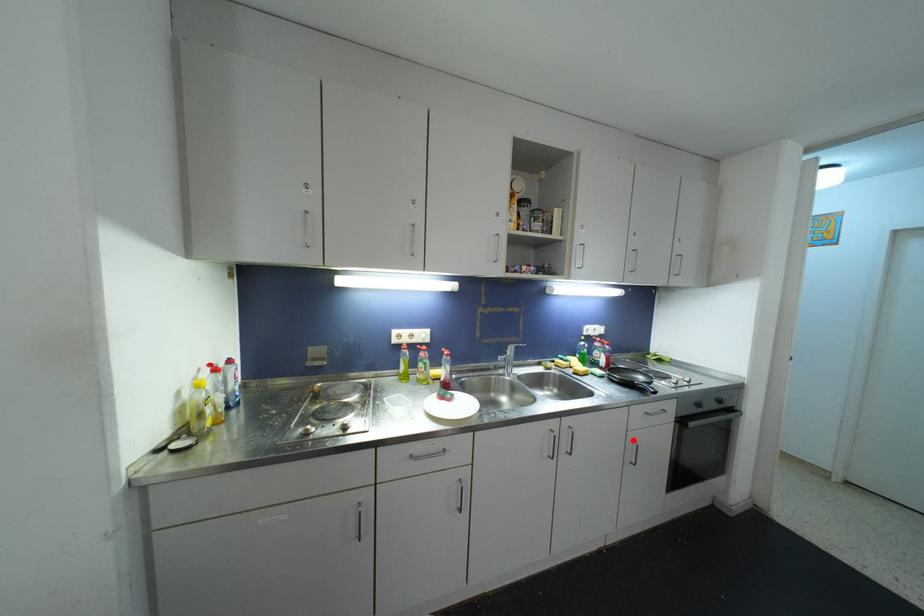
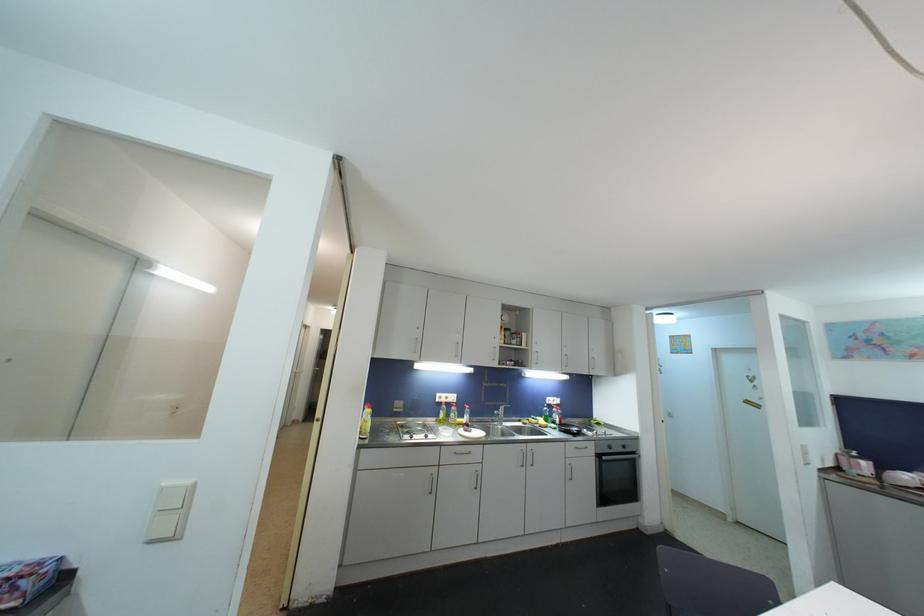
Find the pixel in the second image that matches the highlighted location in the first image.

(570, 464)